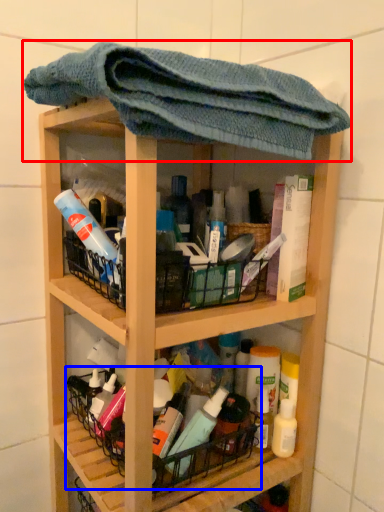
Question: Among these objects, which one is farthest to the camera, towel (highlighted by a red box) or basket (highlighted by a blue box)?

Choices:
 (A) towel
 (B) basket

Answer: (B)